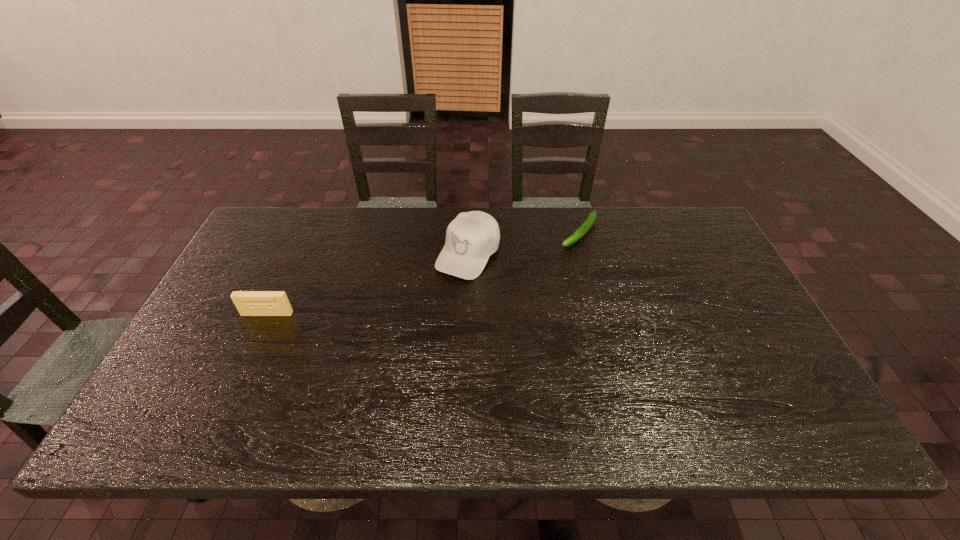
Where is `free point that satisfies the following two spatial constraints: 1. at the front of the watch with spools; 2. on the face of the videotape`? Image resolution: width=960 pixels, height=540 pixels. free point that satisfies the following two spatial constraints: 1. at the front of the watch with spools; 2. on the face of the videotape is located at coordinates (259, 330).

This screenshot has width=960, height=540. Identify the location of free location that satisfies the following two spatial constraints: 1. on the back side of the tallest object; 2. on the left side of the zucchini. (468, 232).

You are a GUI agent. You are given a task and a screenshot of the screen. Output one action in this format:
    pyautogui.click(x=<x>, y=<y>)
    Task: Click on the vacant space that satisfies the following two spatial constraints: 1. at the front of the shortest object with spools; 2. on the face of the videotape
    This screenshot has width=960, height=540.
    Given the screenshot: What is the action you would take?
    pyautogui.click(x=259, y=330)

Find the location of a particular element. free spot that satisfies the following two spatial constraints: 1. on the back side of the zucchini; 2. on the left side of the tallest object is located at coordinates (468, 232).

Where is `free space in the image that satisfies the following two spatial constraints: 1. at the front of the shortest object with spools; 2. on the face of the third shortest object`? Image resolution: width=960 pixels, height=540 pixels. free space in the image that satisfies the following two spatial constraints: 1. at the front of the shortest object with spools; 2. on the face of the third shortest object is located at coordinates (259, 330).

Find the location of `free space that satisfies the following two spatial constraints: 1. on the front side of the zucchini; 2. on the face of the watch`. free space that satisfies the following two spatial constraints: 1. on the front side of the zucchini; 2. on the face of the watch is located at coordinates (605, 330).